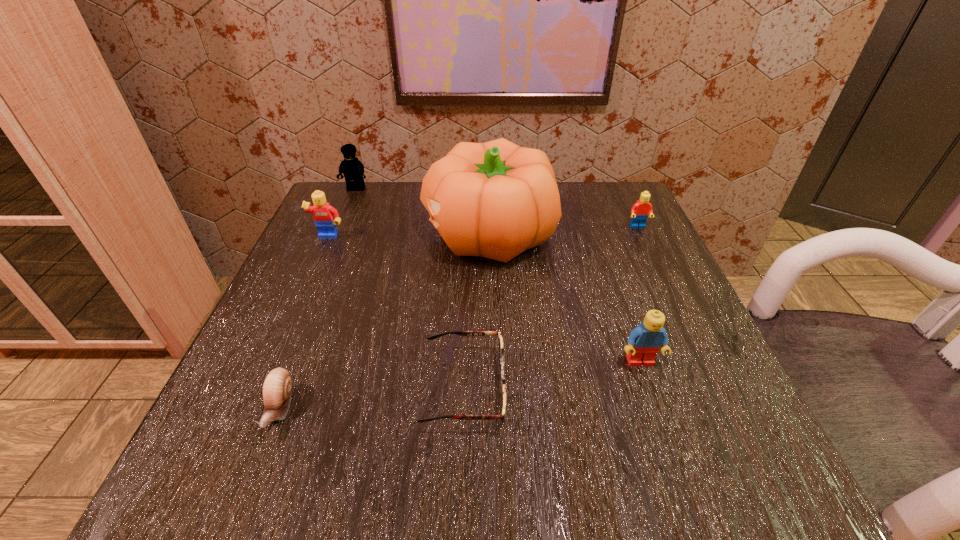
At what (x,y) coordinates should I click in order to perform the action: click on pumpkin. Please return your answer as a coordinate pair (x, y). Looking at the image, I should click on (496, 199).

The image size is (960, 540). I want to click on the farthest object, so click(x=353, y=170).

Identify the location of the third farthest Lego. (325, 216).

What are the coordinates of `the sixth object from left to right` in the screenshot? It's located at (645, 341).

You are a GUI agent. You are given a task and a screenshot of the screen. Output one action in this format:
    pyautogui.click(x=<x>, y=<y>)
    Task: Click on the nearest Lego
    
    Given the screenshot: What is the action you would take?
    pyautogui.click(x=645, y=341)

Where is `the rightmost Lego`? the rightmost Lego is located at coordinates (639, 212).

I want to click on the second farthest Lego, so click(639, 212).

Image resolution: width=960 pixels, height=540 pixels. Identify the location of escargot. (277, 386).

Locate an element on the screen. Image resolution: width=960 pixels, height=540 pixels. the shortest object is located at coordinates (462, 333).

The width and height of the screenshot is (960, 540). I want to click on free space located 0.120m on the carved face of the tallest object, so click(x=368, y=234).